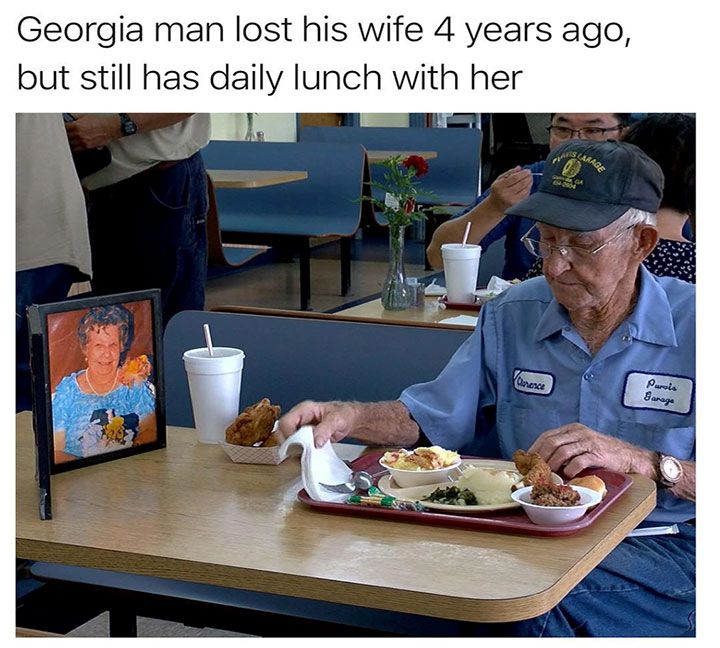
You are a GUI agent. You are given a task and a screenshot of the screen. Output one action in this format:
    pyautogui.click(x=<x>, y=<y>)
    Task: Click on the white cup
    The width and height of the screenshot is (720, 648).
    Given the screenshot: What is the action you would take?
    pyautogui.click(x=225, y=396)